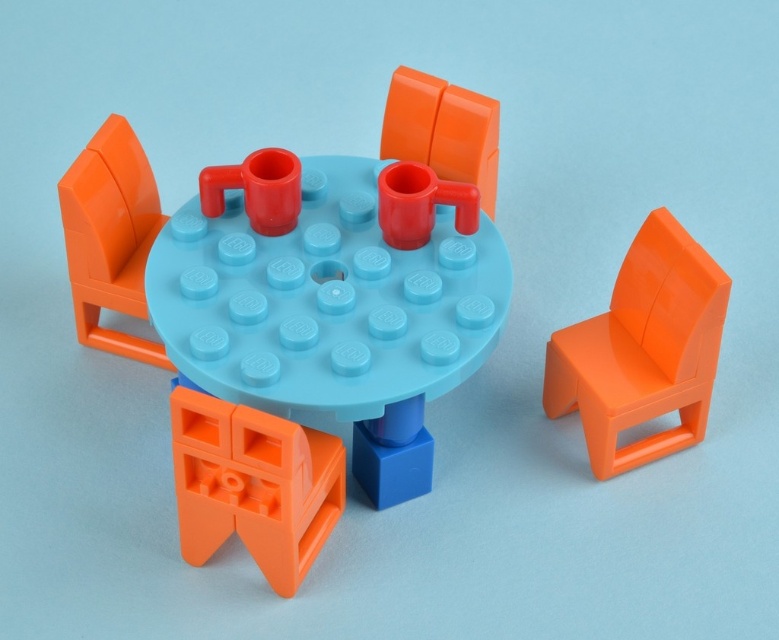
Does light blue plastic table at center appear over orange glossy chair at right?

Yes, light blue plastic table at center is above orange glossy chair at right.

Identify the location of light blue plastic table at center. (333, 300).

Is point (291, 173) more distant than point (649, 410)?

No, (291, 173) is in front of (649, 410).

At what (x,y) coordinates should I click in order to perform the action: click on light blue plastic table at center. Please return your answer as a coordinate pair (x, y). Looking at the image, I should click on (333, 300).

Is light blue plastic table at center behind orange matte chair at center?

No, light blue plastic table at center is closer to the viewer.

Which of these two, light blue plastic table at center or orange matte chair at center, stands shorter?

Standing shorter between the two is orange matte chair at center.

Is point (473, 243) closer to camera compared to point (400, 106)?

Yes.

Locate an element on the screen. light blue plastic table at center is located at coordinates (333, 300).

How much distance is there between orange glossy chair at right and orange matte chair at lower left?

orange glossy chair at right is 18.37 inches from orange matte chair at lower left.

Between orange glossy chair at right and orange matte chair at lower left, which one has less height?

With less height is orange matte chair at lower left.

Is point (557, 394) positioned behind point (206, 481)?

Yes.

The width and height of the screenshot is (779, 640). Identify the location of orange glossy chair at right. (643, 349).